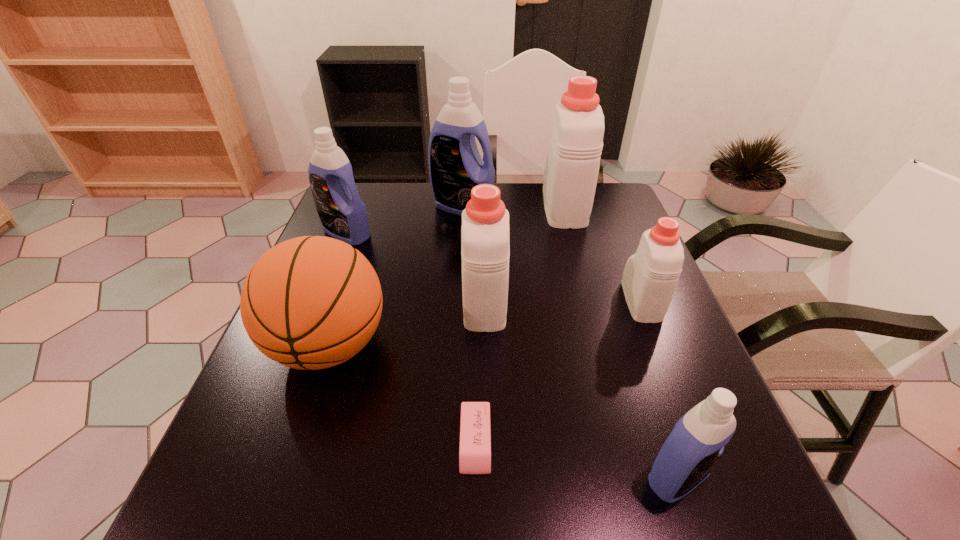
The height and width of the screenshot is (540, 960). Find the location of `the shortest object`. the shortest object is located at coordinates (475, 436).

This screenshot has width=960, height=540. I want to click on pink eraser, so 475,436.

Find the location of a particular element. The image size is (960, 540). free space located 0.210m on the right of the second blue detergent from right to left is located at coordinates (564, 208).

Image resolution: width=960 pixels, height=540 pixels. In order to click on vacant space located 0.050m on the handle side of the leftmost white detergent in this screenshot , I will do (x=484, y=260).

Locate an element on the screen. The width and height of the screenshot is (960, 540). vacant space located 0.180m on the handle side of the leftmost white detergent is located at coordinates (484, 232).

Identify the location of blank area located 0.330m on the handle side of the leftmost white detergent. Image resolution: width=960 pixels, height=540 pixels. (484, 203).

Where is `free space located on the back of the leftmost detergent`? This screenshot has width=960, height=540. free space located on the back of the leftmost detergent is located at coordinates (358, 204).

Where is `free space located 0.160m on the back of the orange basketball`? The width and height of the screenshot is (960, 540). free space located 0.160m on the back of the orange basketball is located at coordinates (358, 260).

This screenshot has height=540, width=960. I want to click on vacant space positioned on the handle side of the rightmost white detergent, so click(x=605, y=207).

At what (x,y) coordinates should I click in order to perform the action: click on vacant space situated on the handle side of the rightmost white detergent. Please return your answer as a coordinate pair (x, y). Looking at the image, I should click on (616, 238).